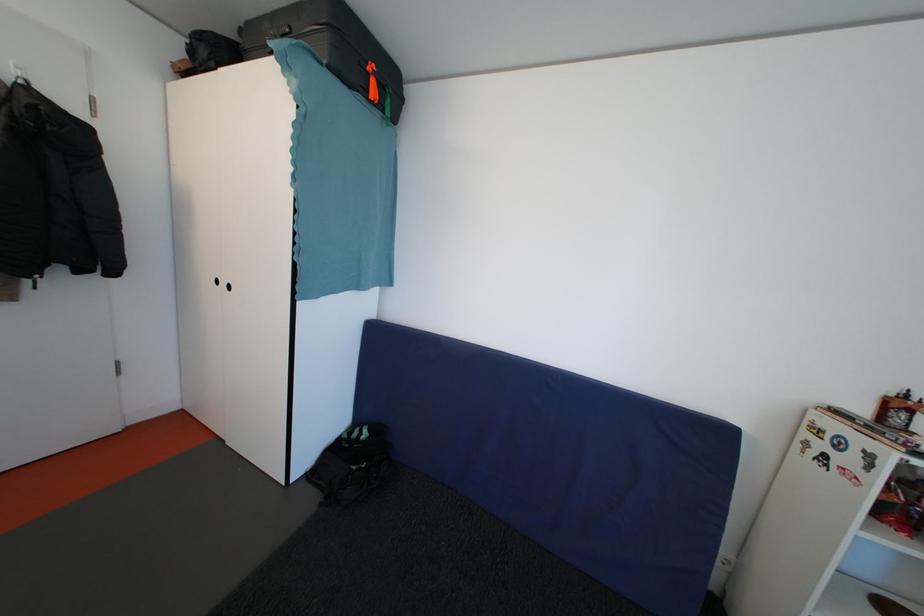
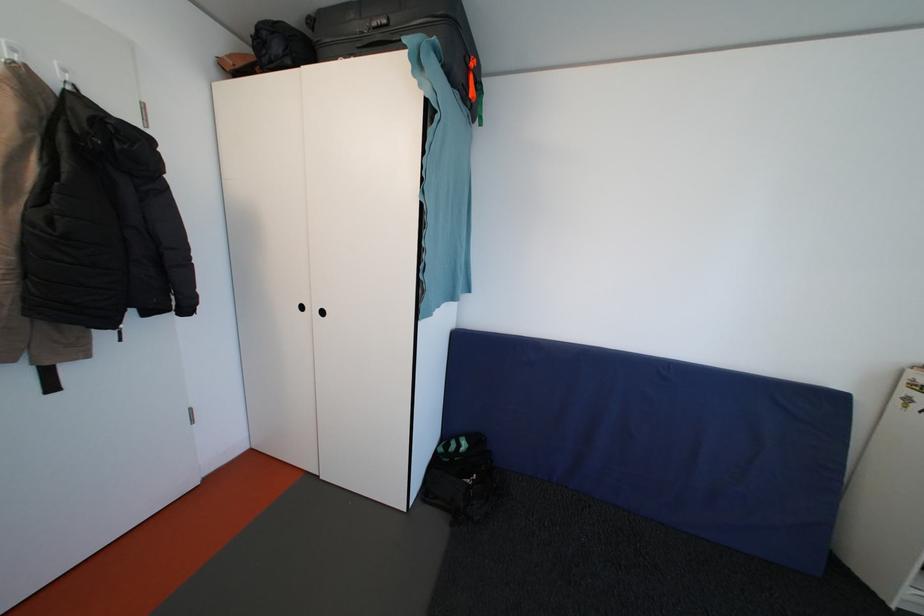
Question: The first image is from the beginning of the video and the second image is from the end. How did the camera likely rotate when shooting the video?

Choices:
 (A) Left
 (B) Right
 (C) Up
 (D) Down

Answer: (B)